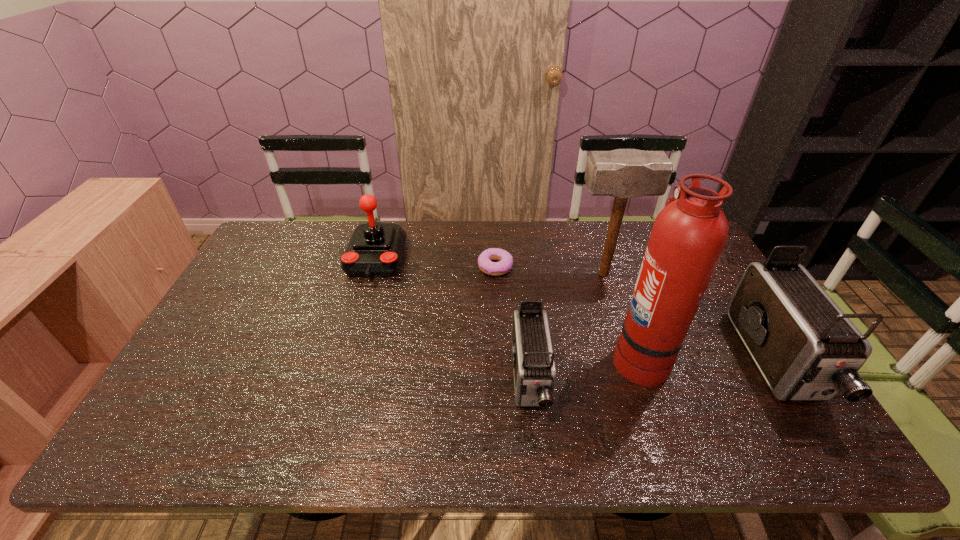
This screenshot has width=960, height=540. I want to click on free spot located 0.190m on the striking face of the mallet, so click(512, 274).

Locate an element on the screen. free space located on the striking face of the mallet is located at coordinates (543, 274).

The height and width of the screenshot is (540, 960). In order to click on free space located on the striking face of the mallet in this screenshot , I will do `click(475, 274)`.

Identify the location of vacant space situated 0.150m on the front of the doughnut. (497, 312).

Find the location of a particular element. The width and height of the screenshot is (960, 540). vacant space located 0.090m on the label side of the tallest object is located at coordinates (578, 357).

This screenshot has width=960, height=540. In order to click on free space located on the label side of the tallest object in this screenshot , I will do `click(555, 357)`.

I want to click on vacant region located on the label side of the tallest object, so click(x=551, y=357).

The width and height of the screenshot is (960, 540). I want to click on joystick located in the far edge section of the desktop, so click(375, 250).

Find the location of a particular element. doughnut that is at the far edge is located at coordinates pyautogui.click(x=485, y=264).

Where is `fire extinguisher positioned at the near edge`? The width and height of the screenshot is (960, 540). fire extinguisher positioned at the near edge is located at coordinates (688, 237).